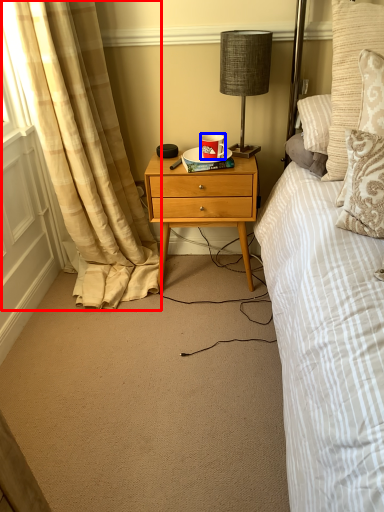
Question: Which object appears closest to the camera in this image, curtain (highlighted by a red box) or coffee cup (highlighted by a blue box)?

Choices:
 (A) curtain
 (B) coffee cup

Answer: (A)